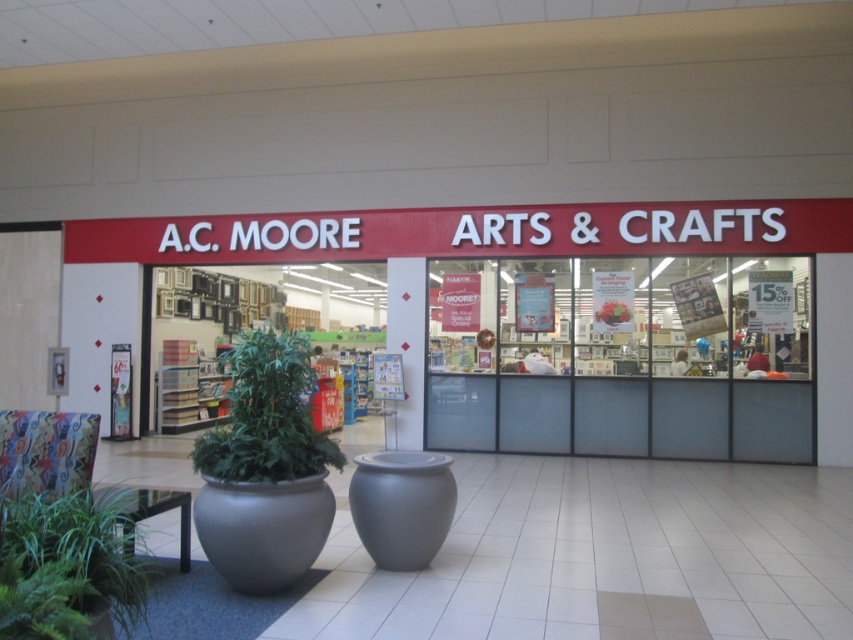
At what (x,y) coordinates should I click in order to perform the action: click on green leafy plant at lower left. Please return your answer as a coordinate pair (x, y). Looking at the image, I should click on (67, 566).

Locate an element on the screen. The height and width of the screenshot is (640, 853). green leafy plant at lower left is located at coordinates (67, 566).

This screenshot has width=853, height=640. I want to click on green leafy plant at lower left, so click(x=67, y=566).

Does matte red sign at center have a lesser height compared to green leafy plant at center?

No.

Which of these two, matte red sign at center or green leafy plant at center, stands shorter?

green leafy plant at center is shorter.

Between point (654, 456) and point (283, 454), which one is positioned in front?

Point (283, 454)

Locate an element on the screen. The image size is (853, 640). matte red sign at center is located at coordinates [x=563, y=317].

Is matte red sign at center positioned in front of green leafy plant at lower left?

No, it is behind green leafy plant at lower left.

Consider the image. Can you confirm if matte red sign at center is positioned above green leafy plant at lower left?

Yes.

Does point (759, 253) come closer to viewer compared to point (125, 600)?

No, it is not.

Identify the location of matte red sign at center. This screenshot has height=640, width=853. (563, 317).